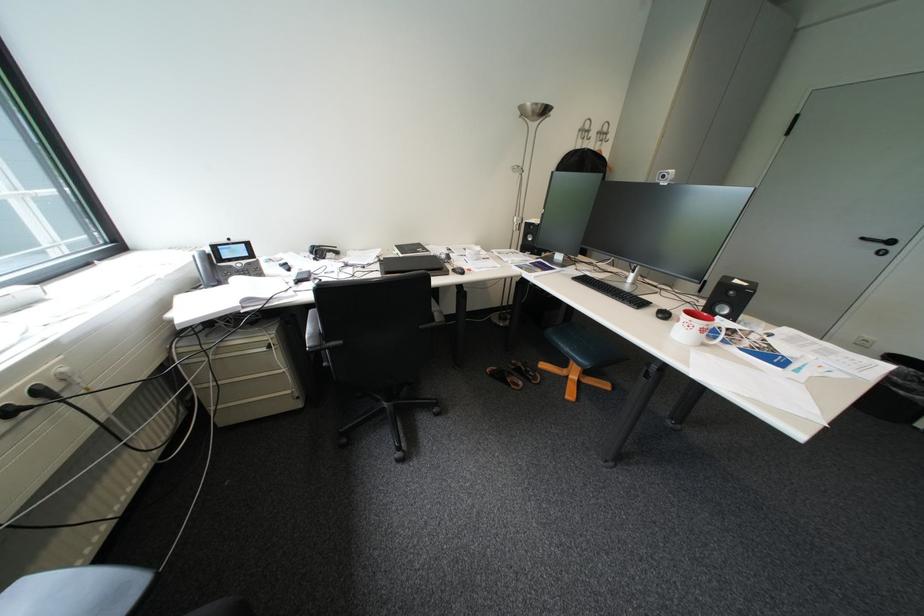
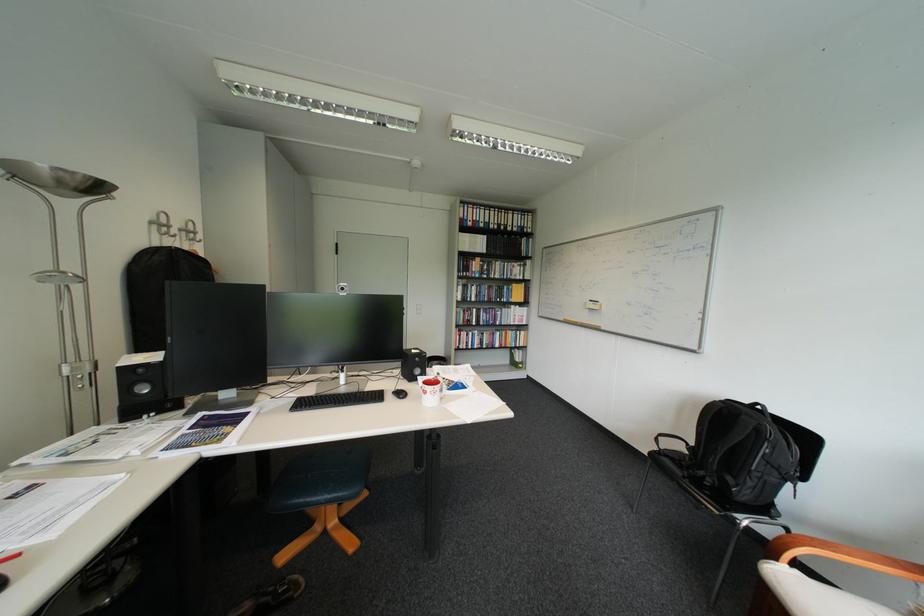
Where in the second image is the point corresponding to point 663,312 from the first image?

(400, 398)